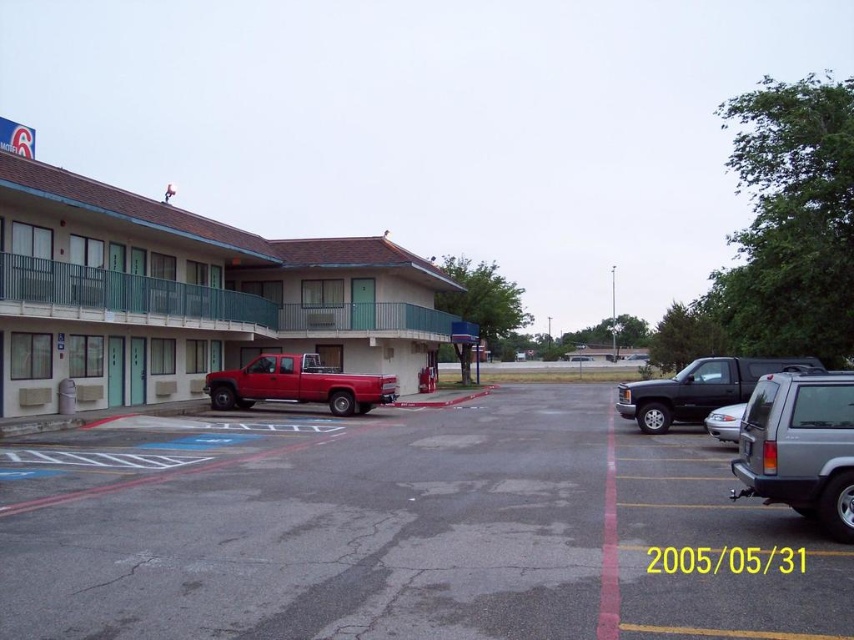
Question: Is matte teal hotel at left closer to camera compared to matte black truck at center?

Choices:
 (A) yes
 (B) no

Answer: (B)

Question: Among these points, which one is farthest from the camera?

Choices:
 (A) (648, 608)
 (B) (702, 358)

Answer: (B)

Question: Can you confirm if silver metallic suv at right is bigger than matte red truck at center?

Choices:
 (A) no
 (B) yes

Answer: (A)

Question: Which object is closer to the camera taking this photo?

Choices:
 (A) matte teal hotel at left
 (B) silver metallic sedan at center-right
 (C) smooth asphalt parking lot at center
 (D) silver metallic suv at right

Answer: (C)

Question: Among these points, which one is farthest from the camera?

Choices:
 (A) (642, 426)
 (B) (344, 356)
 (C) (768, 392)

Answer: (B)

Question: Is silver metallic suv at right bigger than matte red truck at center?

Choices:
 (A) yes
 (B) no

Answer: (B)